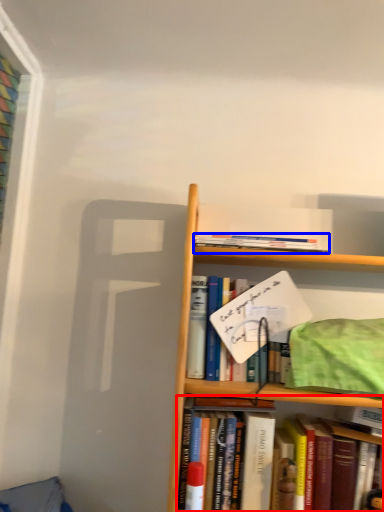
Question: Which object is closer to the camera taking this photo, book (highlighted by a red box) or book (highlighted by a blue box)?

Choices:
 (A) book
 (B) book

Answer: (A)